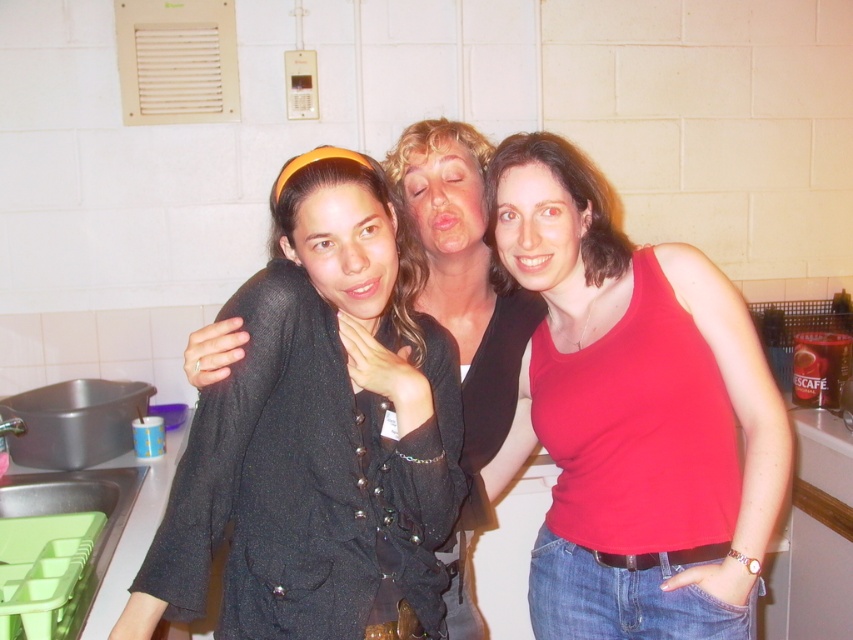
Question: Which object is farther from the camera taking this photo?

Choices:
 (A) black textured jacket at center
 (B) red matte tank top at center

Answer: (B)

Question: Which point is farther from the camera taking this photo?

Choices:
 (A) (566, 170)
 (B) (183, 561)

Answer: (A)

Question: Does black textured jacket at center have a greater width compared to red matte tank top at center?

Choices:
 (A) yes
 (B) no

Answer: (B)

Question: Can you confirm if black textured jacket at center is wider than red matte tank top at center?

Choices:
 (A) no
 (B) yes

Answer: (A)

Question: Does black textured jacket at center appear over red matte tank top at center?

Choices:
 (A) no
 (B) yes

Answer: (A)